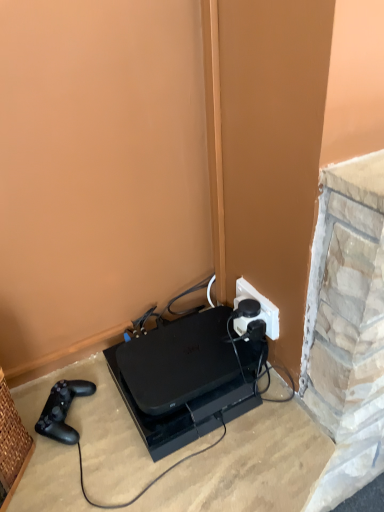
Where is `vacant space that's between black plastic gaming console at lower center and black matte game controller at lower left`? This screenshot has width=384, height=512. vacant space that's between black plastic gaming console at lower center and black matte game controller at lower left is located at coordinates (110, 426).